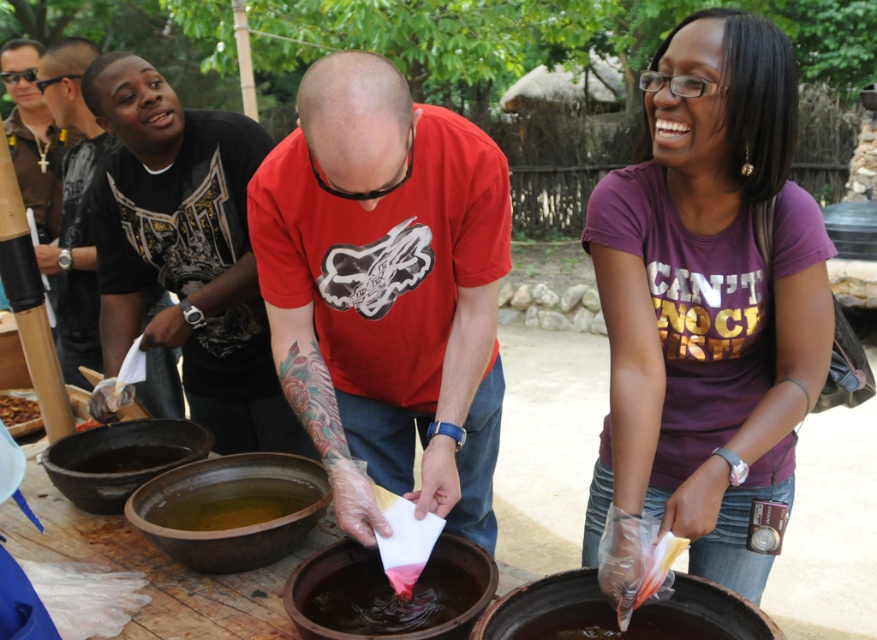
Who is more distant from viewer, (740, 211) or (555, 632)?

Positioned behind is point (740, 211).

Between point (711, 262) and point (532, 632), which one is positioned in front?

Point (532, 632) is in front.

Locate an element on the screen. purple cotton shirt at center is located at coordinates (708, 298).

Where is `purple cotton shirt at center`? The image size is (877, 640). purple cotton shirt at center is located at coordinates (708, 298).

Based on the photo, between matte red t-shirt at center and black matte shirt at left, which one has less height?

matte red t-shirt at center

Does matte red t-shirt at center have a smaller size compared to black matte shirt at left?

Incorrect, matte red t-shirt at center is not smaller in size than black matte shirt at left.

Is point (453, 160) positioned after point (98, 212)?

No, (453, 160) is in front of (98, 212).

This screenshot has width=877, height=640. What are the coordinates of `matte red t-shirt at center` in the screenshot? It's located at (386, 289).

Between point (182, 269) and point (220, 490), which one is positioned in front?

Point (220, 490) is in front.

Is point (219, 275) positioned behind point (210, 496)?

Yes, point (219, 275) is behind point (210, 496).

This screenshot has width=877, height=640. What are the coordinates of `black matte shirt at left` in the screenshot? It's located at (186, 252).